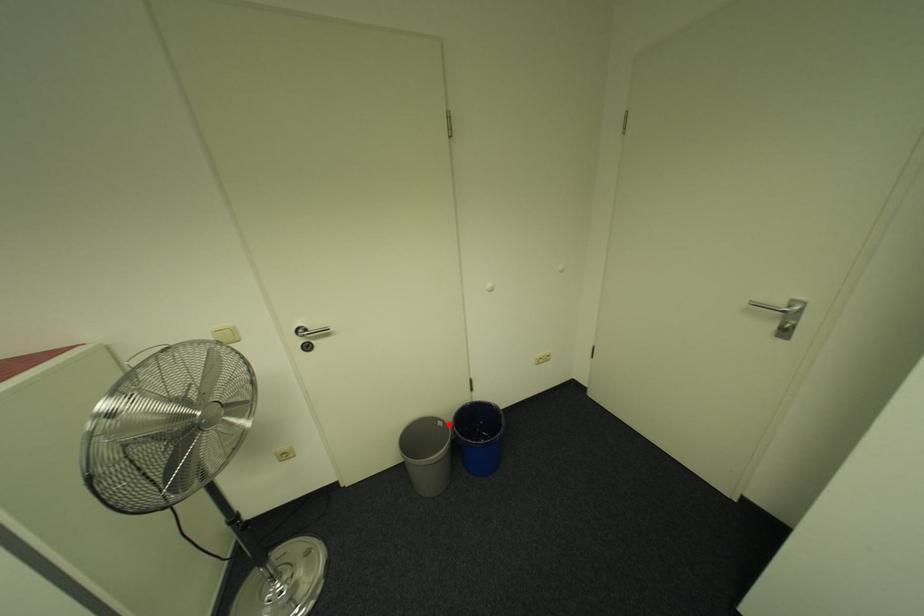
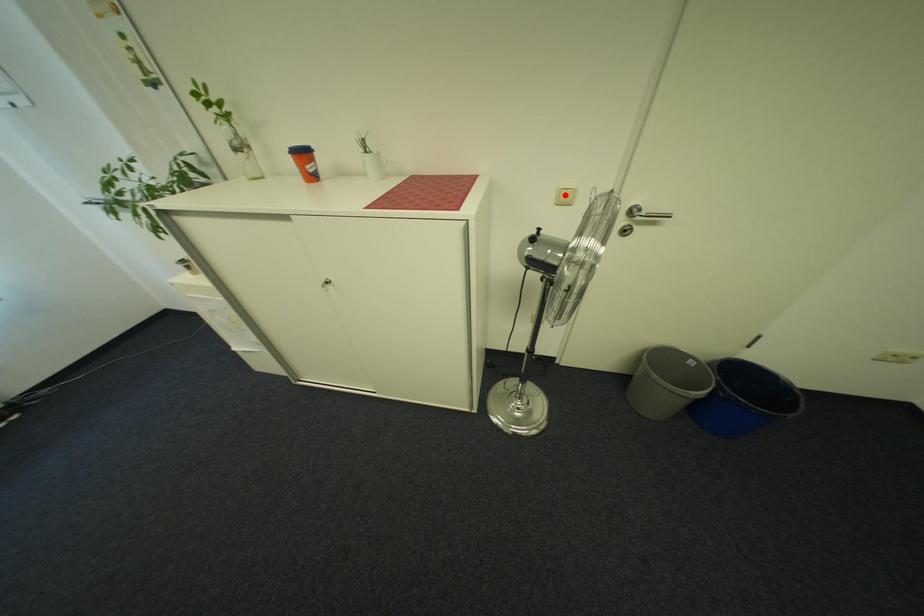
I am providing you with two images of the same scene from different viewpoints. A red point is marked on the first image and another point is marked on the second image. Is the marked point in image1 the same physical position as the marked point in image2?

No